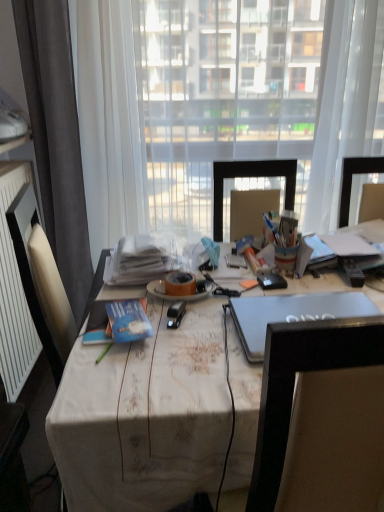
I want to click on free space between sleek silver laptop at center and blue matte book at center, the 1th book ordered from the bottom, so 197,335.